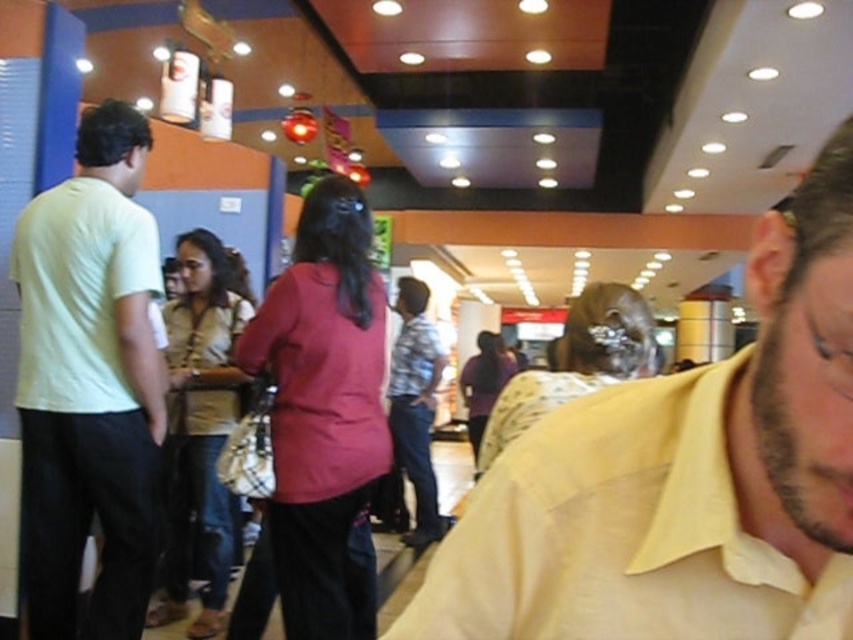
Question: Which point appears farthest from the camera in this image?

Choices:
 (A) (51, 253)
 (B) (637, 419)
 (C) (428, 406)

Answer: (C)

Question: Estimate the real-world distances between objects in this image. Which object is farther from the plaid cotton shirt at center?

Choices:
 (A) light yellow t-shirt at left
 (B) yellow cotton shirt at center

Answer: (B)

Question: Can you confirm if light yellow t-shirt at left is wider than plaid cotton shirt at center?

Choices:
 (A) no
 (B) yes

Answer: (B)

Question: Which point appears farthest from the camera in this image?

Choices:
 (A) (688, 413)
 (B) (397, 365)

Answer: (B)

Question: Where is light yellow t-shirt at left located in relation to plaid cotton shirt at center in the image?

Choices:
 (A) left
 (B) right

Answer: (A)

Question: Is yellow cotton shirt at center bigger than light yellow t-shirt at left?

Choices:
 (A) no
 (B) yes

Answer: (A)